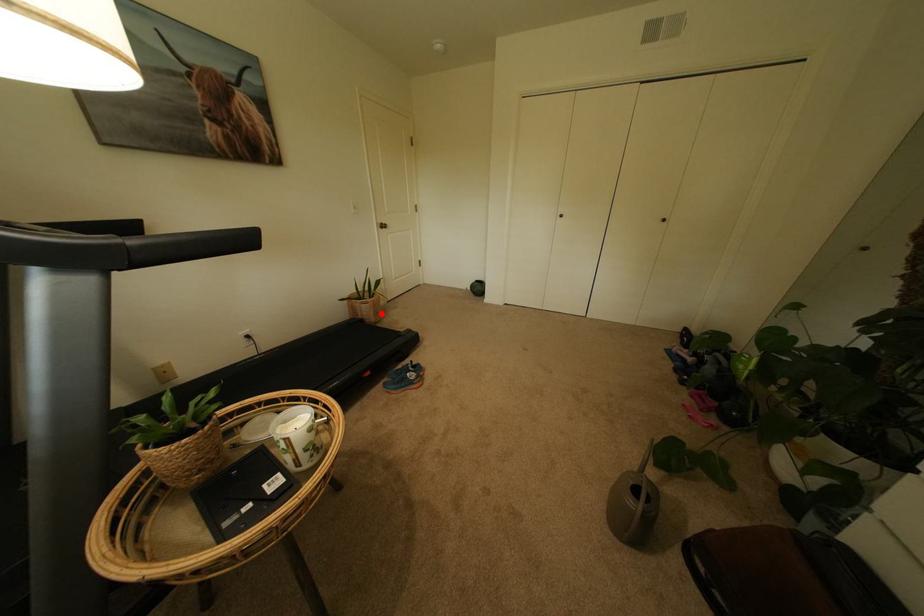
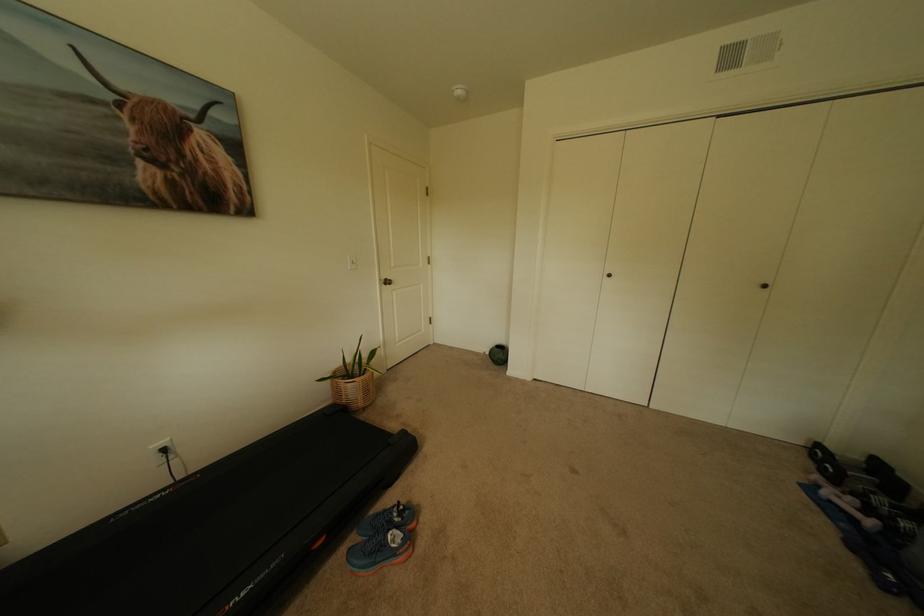
Where in the second image is the point corresponding to the highlighted location from the first image?

(370, 395)